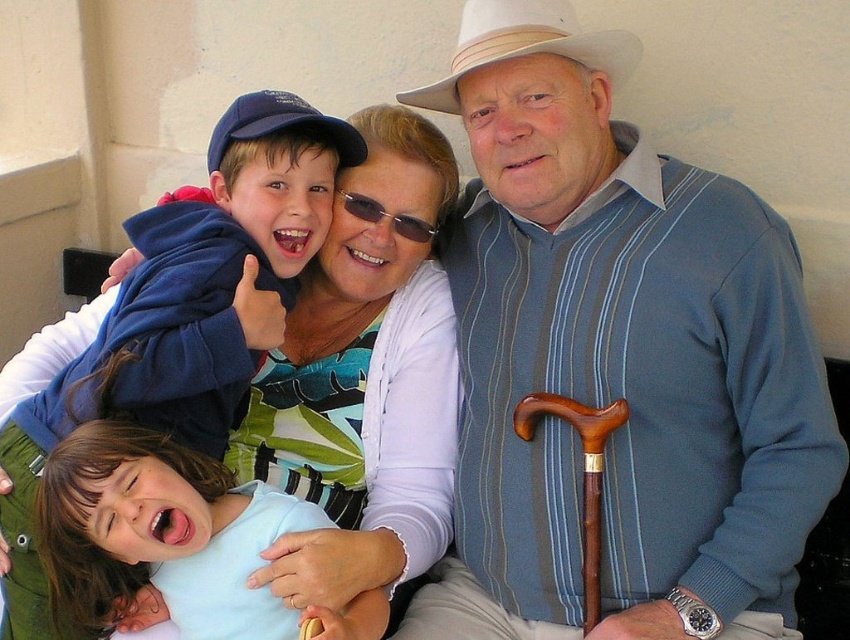
Question: Among these points, which one is nearest to the camera?

Choices:
 (A) (574, 420)
 (B) (64, 372)
 (C) (201, 499)
 (D) (694, 504)

Answer: (C)

Question: Is blue fleece jacket at upper left positioned at the back of wooden cane at lower right?

Choices:
 (A) yes
 (B) no

Answer: (B)

Question: Which point is farther from the camera taking this photo?

Choices:
 (A) (222, 144)
 (B) (98, 432)
 (C) (564, 4)
 (D) (517, 416)

Answer: (A)

Question: Can you confirm if blue striped sweater at center is positioned below white felt cowboy hat at upper center?

Choices:
 (A) yes
 (B) no

Answer: (A)

Question: Is blue fleece jacket at upper left above light blue shirt at lower left?

Choices:
 (A) no
 (B) yes

Answer: (B)

Question: Among these points, which one is nearest to the camera?

Choices:
 (A) [771, 273]
 (B) [340, 625]
 (C) [592, 508]
 (D) [182, 348]

Answer: (B)